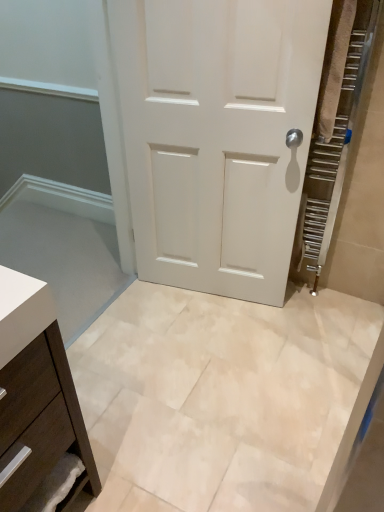
This screenshot has height=512, width=384. Find the location of `vacant space to the right of white matte door at center`. vacant space to the right of white matte door at center is located at coordinates (315, 320).